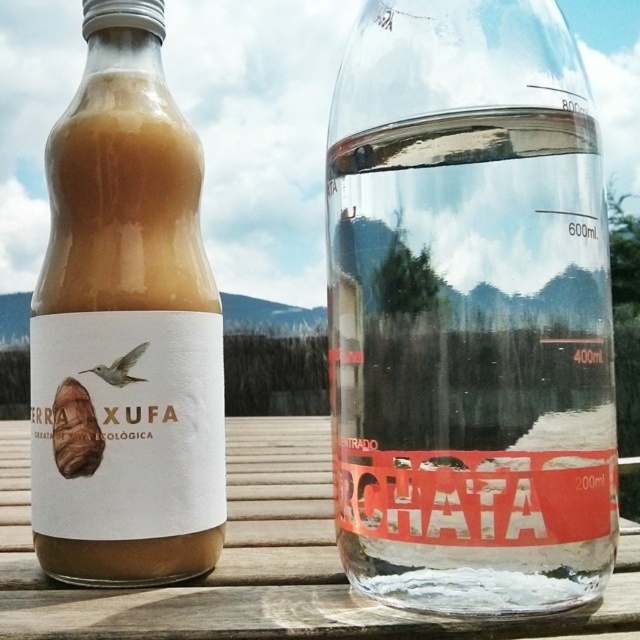
Question: Which point is closer to the camera taking this photo?

Choices:
 (A) (278, 470)
 (B) (424, 337)

Answer: (B)

Question: Which point is farther to the camera?

Choices:
 (A) (426, 620)
 (B) (186, 300)

Answer: (B)

Question: Does transparent glass bottle at center appear on the left side of transparent wood table at center?

Choices:
 (A) no
 (B) yes

Answer: (A)

Question: Is transparent glass bottle at center to the left of matte glass bottle at left from the viewer's perspective?

Choices:
 (A) no
 (B) yes

Answer: (A)

Question: In this image, where is transparent glass bottle at center located relative to matte glass bottle at left?

Choices:
 (A) left
 (B) right

Answer: (B)

Question: Which object appears farthest from the camera in this image?

Choices:
 (A) matte glass bottle at left
 (B) transparent glass bottle at center

Answer: (A)